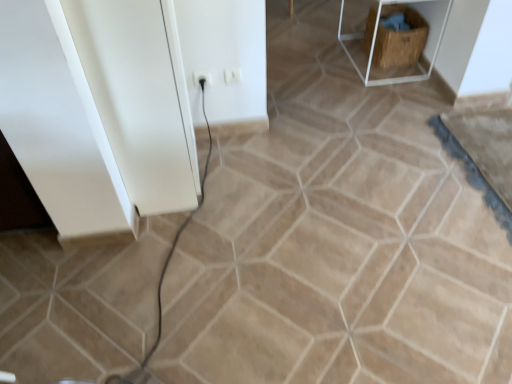
Question: In terms of height, does wooden crate at upper right look taller or shorter compared to white plastic electric outlet at center, the first electric outlet in the left-to-right sequence?

Choices:
 (A) tall
 (B) short

Answer: (A)

Question: Considering their positions, is wooden crate at upper right located in front of or behind white plastic electric outlet at center, the first electric outlet in the left-to-right sequence?

Choices:
 (A) behind
 (B) front

Answer: (A)

Question: Which is farther from the brown woven crate at upper right?

Choices:
 (A) white plastic electric outlet at center, which is the second electric outlet in left-to-right order
 (B) wooden crate at upper right
 (C) white plastic electric outlet at center, the first electric outlet in the left-to-right sequence
 (D) white glossy cabinet at left

Answer: (D)

Question: Which object is the closest to the white glossy cabinet at left?

Choices:
 (A) white plastic electric outlet at center, the first electric outlet in the left-to-right sequence
 (B) white plastic electric outlet at center, marked as the 1th electric outlet in a right-to-left arrangement
 (C) wooden crate at upper right
 (D) brown woven crate at upper right

Answer: (A)